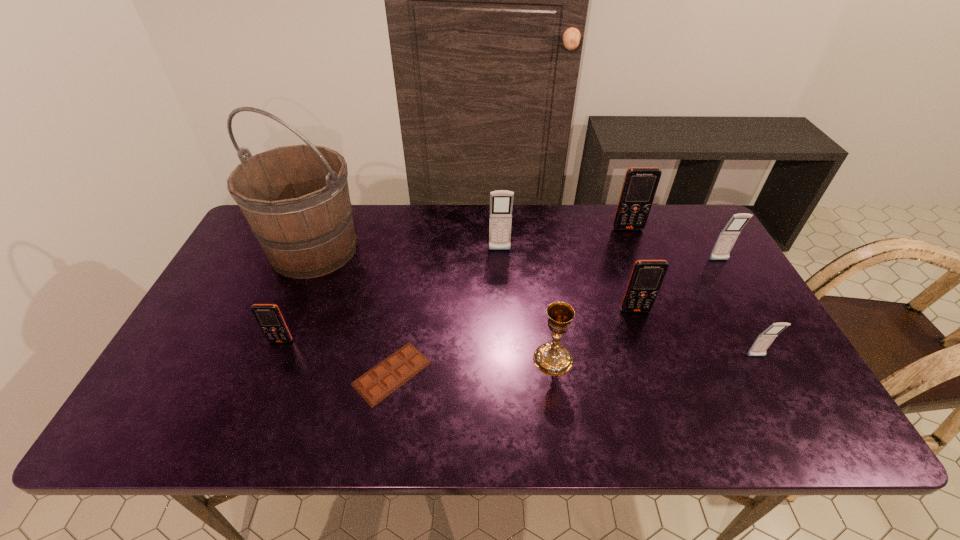
The width and height of the screenshot is (960, 540). In order to click on free space between the second nearest gray cellular telephone and the smallest gray cellular telephone in this screenshot , I will do `click(737, 308)`.

Identify the location of vacant area between the fifth object from right to left and the tallest object. (433, 305).

The height and width of the screenshot is (540, 960). In order to click on unoccupied position between the nearest gray cellular telephone and the farthest orange cellular telephone in this screenshot , I will do `click(692, 293)`.

Locate an element on the screen. The height and width of the screenshot is (540, 960). free point between the smallest gray cellular telephone and the tallest object is located at coordinates (535, 303).

The image size is (960, 540). Find the location of `empty space between the fifth object from right to left and the bucket`. empty space between the fifth object from right to left and the bucket is located at coordinates (433, 305).

Find the location of a particular element. The width and height of the screenshot is (960, 540). object that is the seventh closest to the bucket is located at coordinates (764, 340).

I want to click on object that stands as the eighth closest to the fifth farthest cellular telephone, so click(x=728, y=236).

Locate which cellular telephone ranks fifth in proximity to the leftmost cellular telephone. Please provide its 2D coordinates. Your answer should be formatted as a tuple, i.e. [(x, y)], where the tuple contains the x and y coordinates of a point satisfying the conditions above.

[(728, 236)]

Identify which cellular telephone is located as the nearest to the leftmost orange cellular telephone. Please provide its 2D coordinates. Your answer should be formatted as a tuple, i.e. [(x, y)], where the tuple contains the x and y coordinates of a point satisfying the conditions above.

[(501, 201)]

Select which gray cellular telephone appears as the third closest to the biggest orange cellular telephone. Please provide its 2D coordinates. Your answer should be formatted as a tuple, i.e. [(x, y)], where the tuple contains the x and y coordinates of a point satisfying the conditions above.

[(764, 340)]